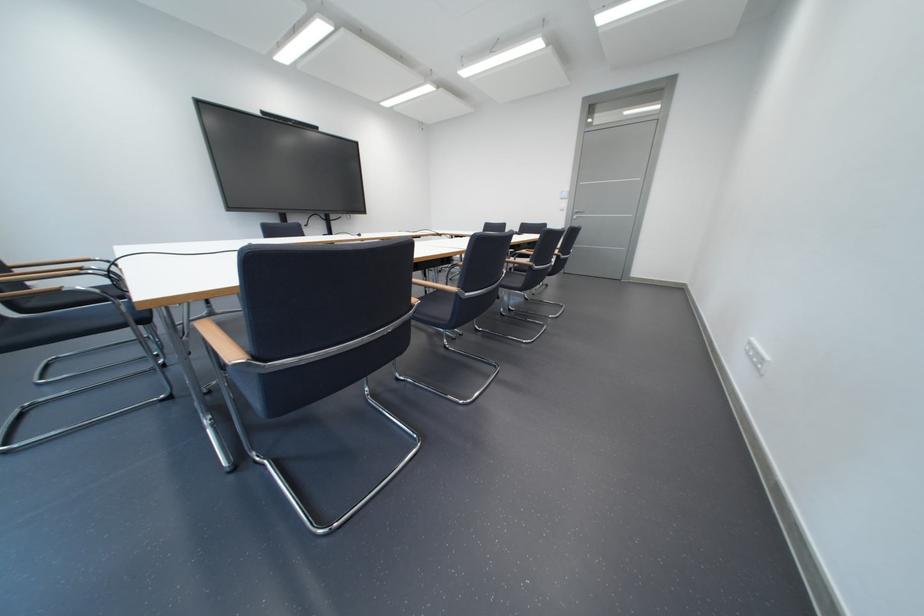
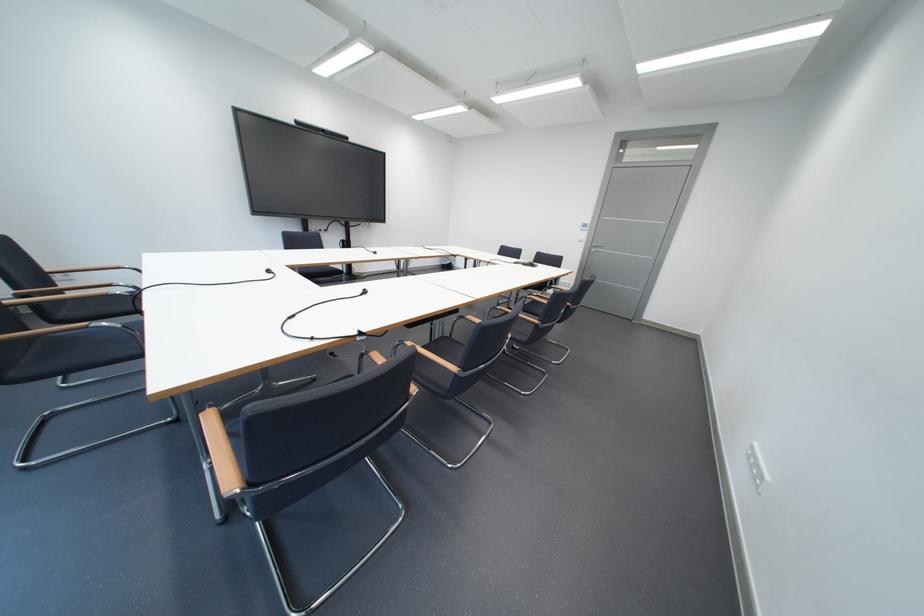
Where in the second image is the point corresponding to [43,306] from the first image?

(74, 317)